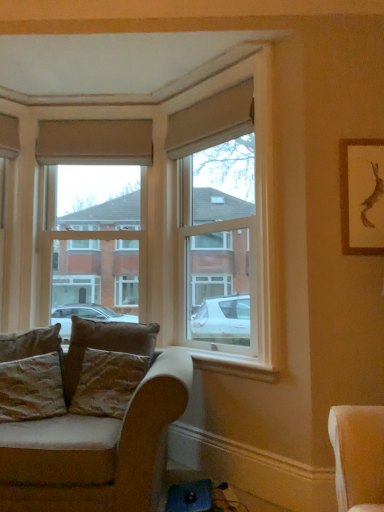
The width and height of the screenshot is (384, 512). Identify the location of free space above beige fabric curtain at upper center, the first curtain viewed from the left (from a real-world perspective). (99, 116).